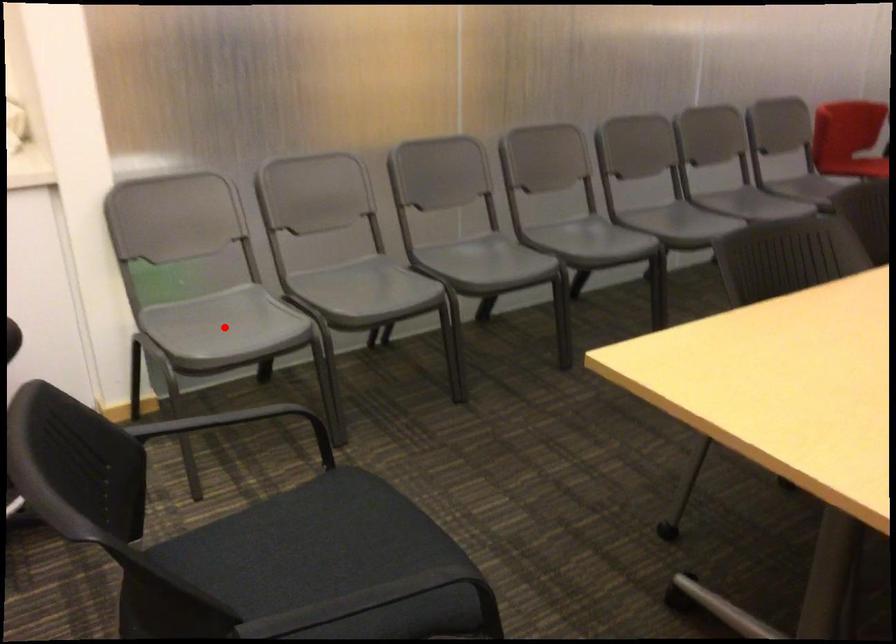
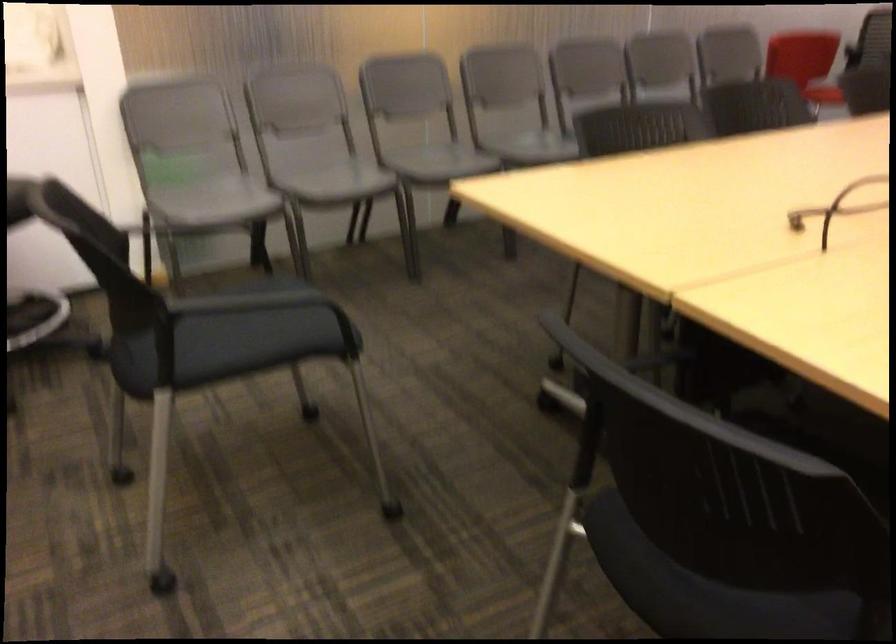
Find the pixel in the second image that matches the highlighted location in the first image.

(213, 201)